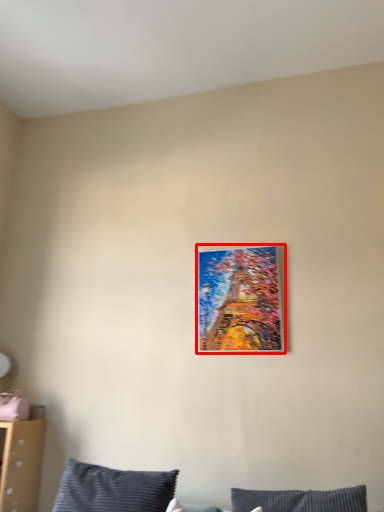
Question: From the image's perspective, where is picture frame (annotated by the red box) located in relation to pillow in the image?

Choices:
 (A) above
 (B) below

Answer: (A)